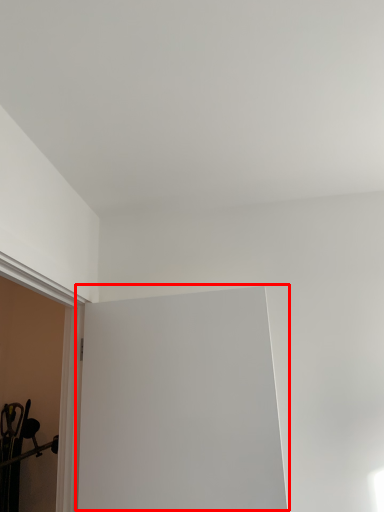
Question: From the image's perspective, what is the correct spatial relationship of window screen (annotated by the red box) in relation to window sill?

Choices:
 (A) above
 (B) below

Answer: (B)